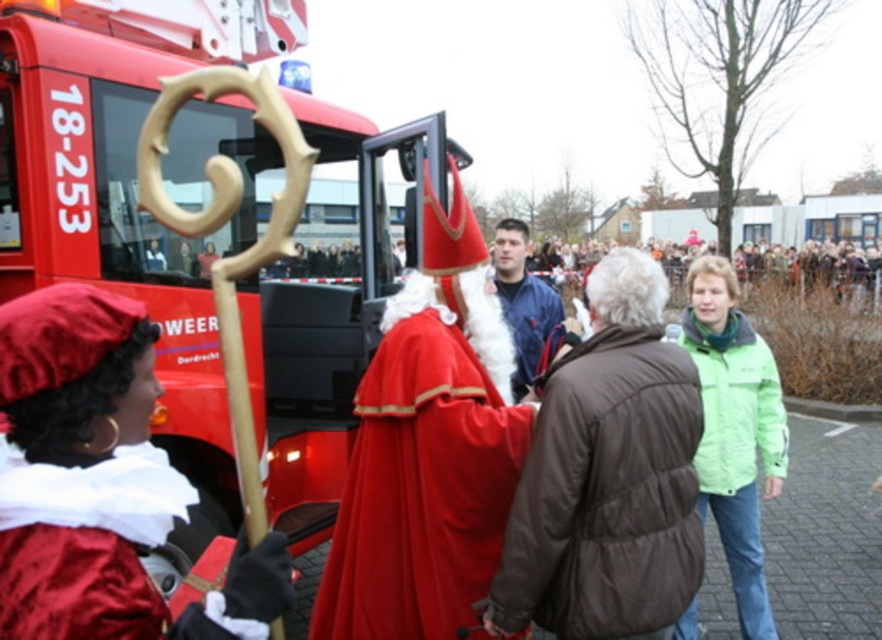
Question: Estimate the real-world distances between objects in this image. Which object is closer to the velvet red robe at center?

Choices:
 (A) green fabric crowd at upper center
 (B) red matte fire truck at upper left
 (C) blue fabric jacket at center

Answer: (B)

Question: Is velvet red cape at center wider than green fabric crowd at upper center?

Choices:
 (A) no
 (B) yes

Answer: (A)

Question: Is velvet red robe at center further to the viewer compared to blue fabric jacket at center?

Choices:
 (A) yes
 (B) no

Answer: (B)

Question: Which point is farther to the camera?

Choices:
 (A) green matte jacket at lower right
 (B) velvet red cape at center
 (C) red matte fire truck at upper left

Answer: (A)

Question: Does velvet red robe at center have a smaller size compared to blue fabric jacket at center?

Choices:
 (A) no
 (B) yes

Answer: (A)

Question: Among these points, which one is nearest to the camera?

Choices:
 (A) (558, 586)
 (B) (153, 493)

Answer: (B)